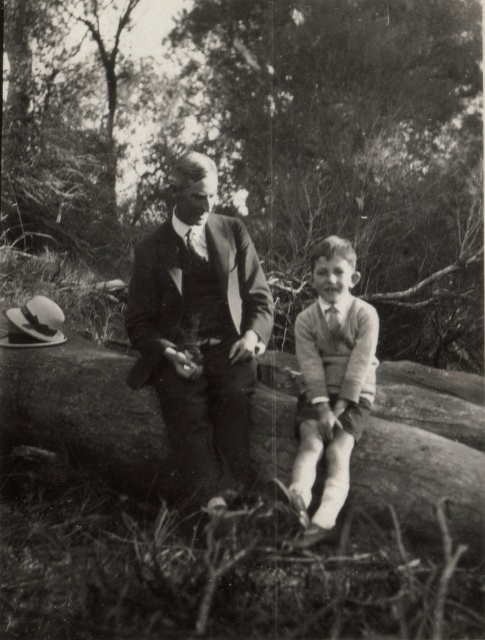
Between smooth bark tree trunk at center and smooth suit at center, which one appears on the left side from the viewer's perspective?

smooth suit at center

Does smooth bark tree trunk at center appear under smooth suit at center?

Actually, smooth bark tree trunk at center is above smooth suit at center.

Which is behind, point (150, 81) or point (193, 163)?

The point (150, 81) is more distant.

This screenshot has width=485, height=640. Identify the location of smooth bark tree trunk at center. (268, 147).

Is smooth bark tree trunk at center wider than knitted sweater at center?

Correct, the width of smooth bark tree trunk at center exceeds that of knitted sweater at center.

Can you confirm if smooth bark tree trunk at center is bigger than knitted sweater at center?

Yes, smooth bark tree trunk at center is bigger than knitted sweater at center.

I want to click on smooth bark tree trunk at center, so click(x=268, y=147).

The height and width of the screenshot is (640, 485). Find the location of `smooth bark tree trunk at center`. smooth bark tree trunk at center is located at coordinates point(268,147).

Consider the image. Is smooth suit at center thinner than knitted sweater at center?

In fact, smooth suit at center might be wider than knitted sweater at center.

Does smooth suit at center come behind knitted sweater at center?

Yes.

Find the location of a particular element. This screenshot has height=640, width=485. smooth suit at center is located at coordinates [x=199, y=328].

Locate an element on the screen. The image size is (485, 640). smooth suit at center is located at coordinates (199, 328).